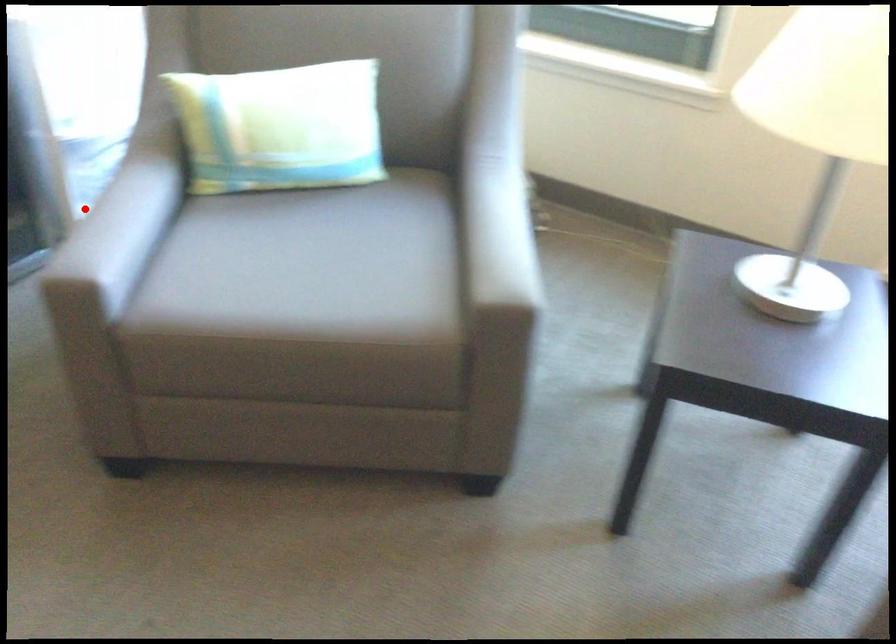
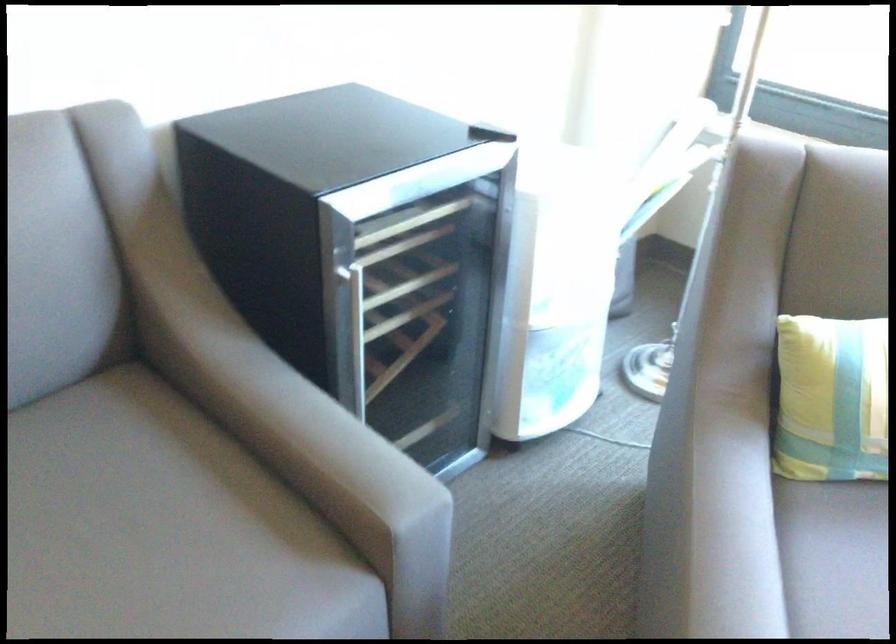
The point at the highlighted location is marked in the first image. Where is the corresponding point in the second image?

(711, 522)